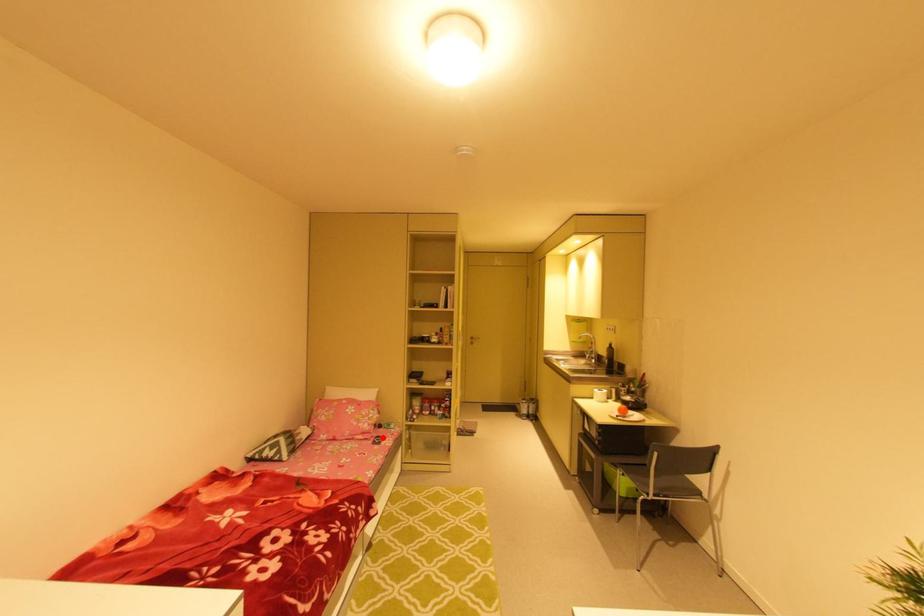
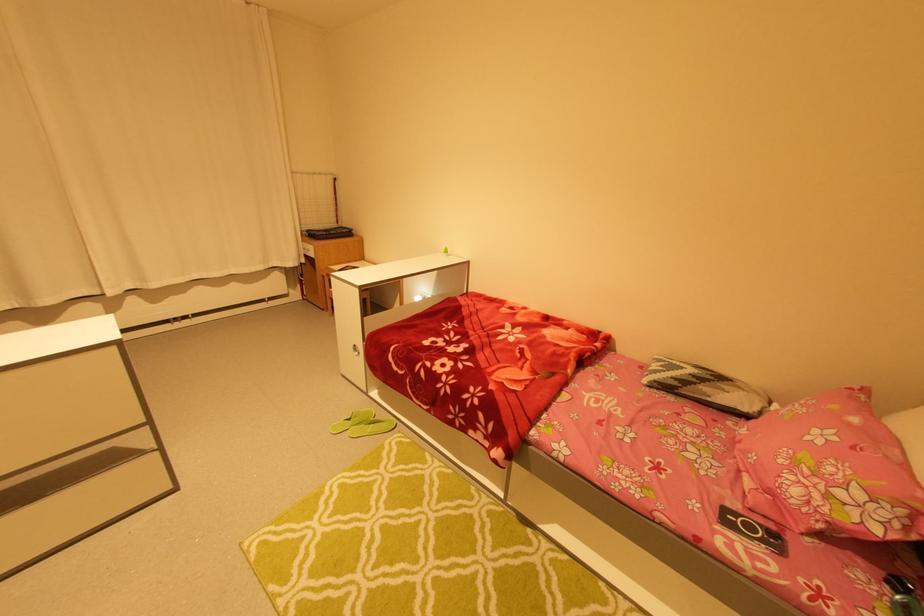
Find the pixel in the second image that matches the highlighted location in the first image.

(781, 536)